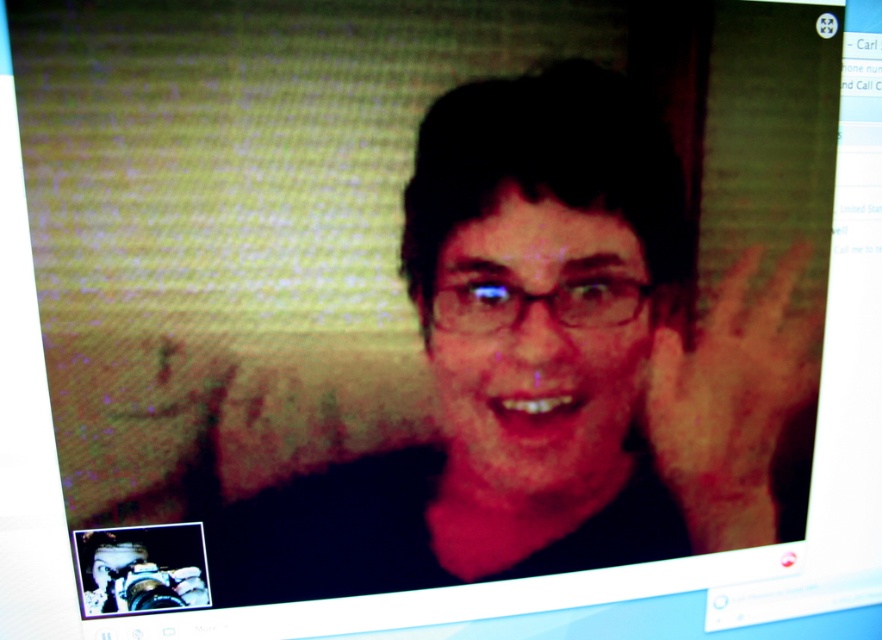
Question: Is matte black face at center wider than brown skin at right?

Choices:
 (A) no
 (B) yes

Answer: (B)

Question: Is matte black face at center positioned behind brown skin at right?

Choices:
 (A) yes
 (B) no

Answer: (B)

Question: Does matte black face at center have a greater width compared to brown skin at right?

Choices:
 (A) no
 (B) yes

Answer: (B)

Question: Which object is farther from the camera taking this photo?

Choices:
 (A) brown skin at right
 (B) matte black face at center

Answer: (A)